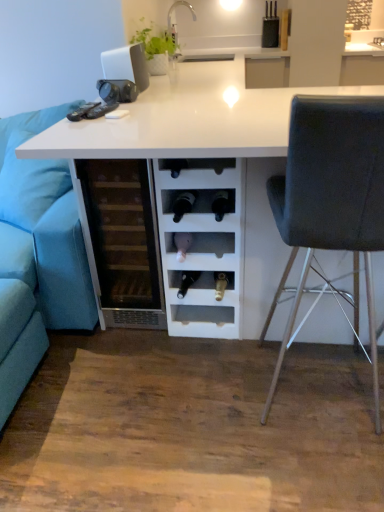
Question: Could you tell me if white glossy table at center is turned towards transparent glass wine cooler at center?

Choices:
 (A) yes
 (B) no

Answer: (B)

Question: From the image's perspective, is white glossy table at center below transparent glass wine cooler at center?

Choices:
 (A) no
 (B) yes

Answer: (A)

Question: Does white glossy table at center have a greater width compared to transparent glass wine cooler at center?

Choices:
 (A) yes
 (B) no

Answer: (A)

Question: Is white glossy table at center further to camera compared to transparent glass wine cooler at center?

Choices:
 (A) yes
 (B) no

Answer: (B)

Question: Considering the relative sizes of white glossy table at center and transparent glass wine cooler at center in the image provided, is white glossy table at center smaller than transparent glass wine cooler at center?

Choices:
 (A) yes
 (B) no

Answer: (B)

Question: Is white matte laptop at upper center inside the boundaries of white glossy table at center, or outside?

Choices:
 (A) outside
 (B) inside

Answer: (B)

Question: Is point (137, 87) closer or farther from the camera than point (261, 224)?

Choices:
 (A) farther
 (B) closer

Answer: (A)

Question: Considering the positions of white matte laptop at upper center and white glossy table at center in the image, is white matte laptop at upper center bigger or smaller than white glossy table at center?

Choices:
 (A) small
 (B) big

Answer: (A)

Question: Considering the relative positions of white matte laptop at upper center and white glossy table at center in the image provided, is white matte laptop at upper center to the left or to the right of white glossy table at center?

Choices:
 (A) right
 (B) left

Answer: (B)

Question: In the image, is blue fabric couch at left on the left side or the right side of white matte laptop at upper center?

Choices:
 (A) right
 (B) left

Answer: (B)

Question: Is blue fabric couch at left inside the boundaries of white matte laptop at upper center, or outside?

Choices:
 (A) outside
 (B) inside

Answer: (A)

Question: In terms of width, does blue fabric couch at left look wider or thinner when compared to white matte laptop at upper center?

Choices:
 (A) wide
 (B) thin

Answer: (A)

Question: From their relative heights in the image, would you say blue fabric couch at left is taller or shorter than white matte laptop at upper center?

Choices:
 (A) tall
 (B) short

Answer: (A)

Question: Is dark grey fabric chair at right wider or thinner than blue fabric couch at left?

Choices:
 (A) wide
 (B) thin

Answer: (B)

Question: In the image, is dark grey fabric chair at right positioned in front of or behind blue fabric couch at left?

Choices:
 (A) front
 (B) behind

Answer: (A)